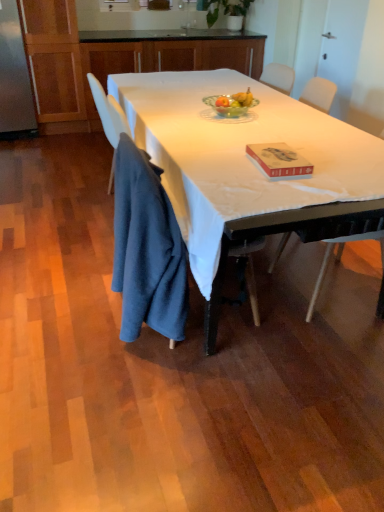
Question: From the image's perspective, is green glass bowl at center positioned above or below red matte book at center?

Choices:
 (A) above
 (B) below

Answer: (A)

Question: Considering the positions of green glass bowl at center and red matte book at center in the image, is green glass bowl at center wider or thinner than red matte book at center?

Choices:
 (A) thin
 (B) wide

Answer: (A)

Question: Which of these objects is positioned farthest from the dark blue fabric at lower left?

Choices:
 (A) wooden cabinets at upper center, acting as the first cabinetry starting from the top
 (B) white plastic chair at right
 (C) white matte table at center
 (D) white glossy sink at upper center
 (E) wooden cabinet at upper center, which appears as the 2th cabinetry when viewed from the top

Answer: (D)

Question: Based on their relative distances, which object is nearer to the red matte book at center?

Choices:
 (A) white matte table at center
 (B) green leafy plant at upper center
 (C) wooden cabinet at upper center, which appears as the 2th cabinetry when viewed from the top
 (D) white glossy sink at upper center
 (E) white plastic chair at right

Answer: (A)